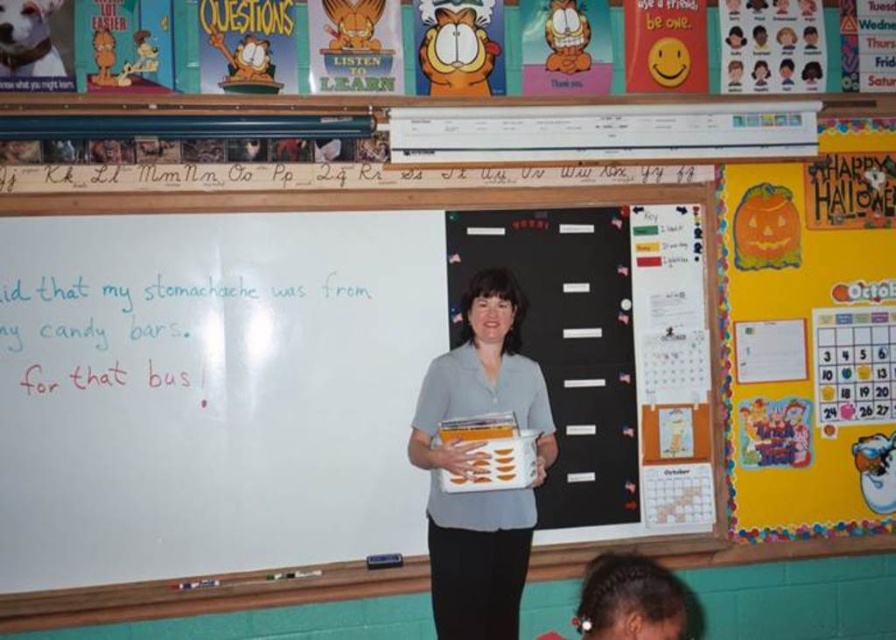
You are a student in the classroom and need to check the schedule. You see the yellow paper calendar at upper right and the gray fabric shirt at center. Which object is bigger?

The yellow paper calendar at upper right is larger in size than the gray fabric shirt at center.

You are a student in the classroom and need to check the date of an upcoming event. You see the yellow paper calendar at upper right and the gray fabric shirt at center. Which object should you look at to find the event date?

The yellow paper calendar at upper right is positioned on the left side of gray fabric shirt at center. Since the calendar is used to track dates and events, you should look at the yellow paper calendar at upper right to find the event date.